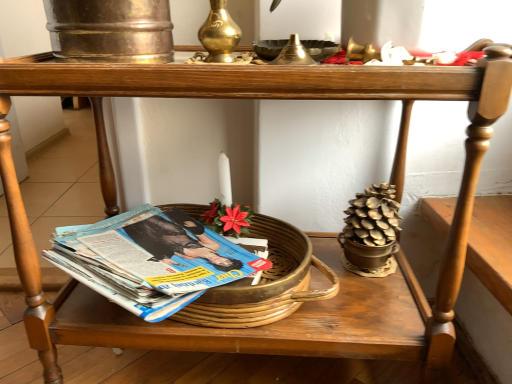
Identify the location of vacant space to the left of metallic gold bowl at upper center. The width and height of the screenshot is (512, 384). (164, 57).